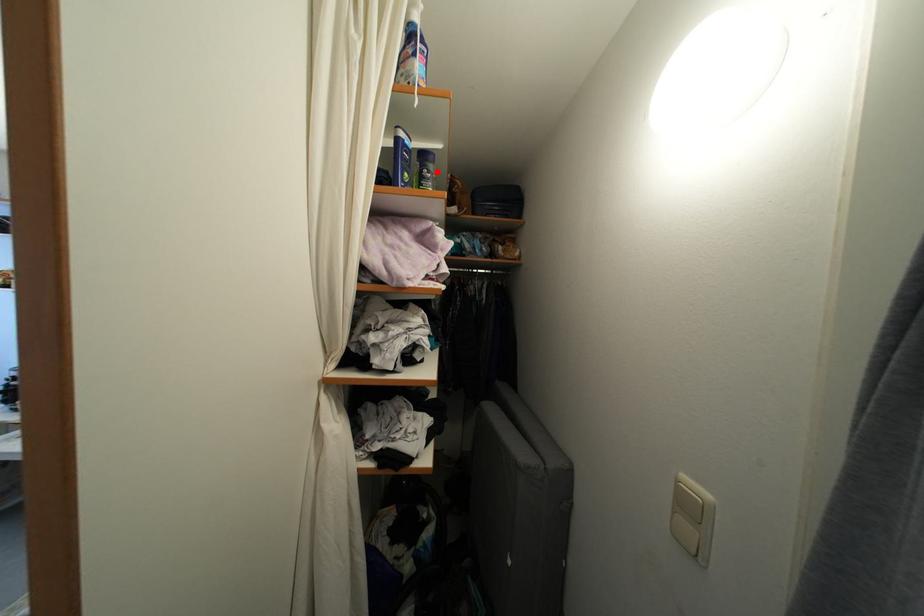
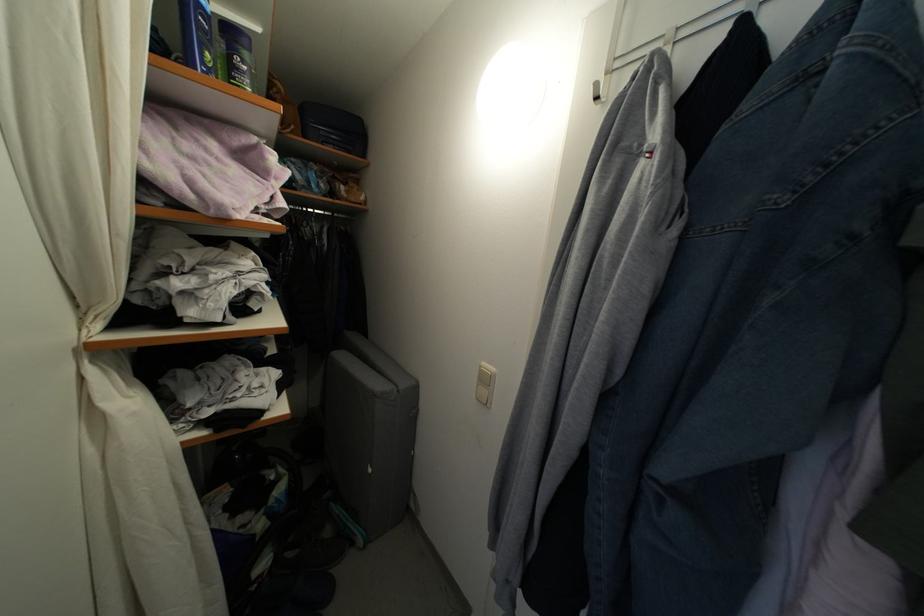
Where in the second image is the point corresponding to the highlighted location from the first image?

(251, 61)